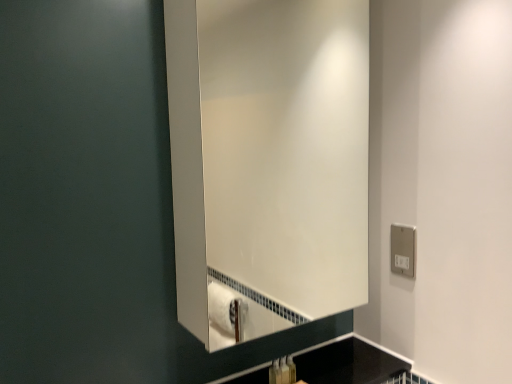
Measure the distance between black glossy countertop at lower center and camera.

3.68 feet.

Locate an element on the screen. This screenshot has height=384, width=512. silver metallic electric outlet at right is located at coordinates pos(403,250).

This screenshot has width=512, height=384. In order to click on white glossy mirror at center in this screenshot , I will do `click(267, 162)`.

Is matte plastic toothbrush at lower center, positioned as the first toiletry in right-to-left order, bigger than silver metallic electric outlet at right?

No.

Is there a large distance between matte plastic toothbrush at lower center, which appears as the second toiletry when viewed from the left, and silver metallic electric outlet at right?

matte plastic toothbrush at lower center, which appears as the second toiletry when viewed from the left, is near silver metallic electric outlet at right, not far away.

Is silver metallic electric outlet at right inside matte plastic toothbrush at lower center, which appears as the second toiletry when viewed from the left?

That's incorrect, silver metallic electric outlet at right is not inside matte plastic toothbrush at lower center, which appears as the second toiletry when viewed from the left.

Which is less distant, [286,363] or [278,209]?

Clearly, point [286,363] is closer to the camera than point [278,209].

Who is smaller, matte plastic toothbrush at lower center, positioned as the first toiletry in right-to-left order, or white glossy mirror at center?

matte plastic toothbrush at lower center, positioned as the first toiletry in right-to-left order, is smaller.

Is matte plastic toothbrush at lower center, which appears as the second toiletry when viewed from the left, situated inside white glossy mirror at center or outside?

matte plastic toothbrush at lower center, which appears as the second toiletry when viewed from the left, cannot be found inside white glossy mirror at center.

Is matte plastic toothbrush at lower center, which appears as the second toiletry when viewed from the left, at the back of white glossy mirror at center?

white glossy mirror at center does not have its back to matte plastic toothbrush at lower center, which appears as the second toiletry when viewed from the left.

Considering the sizes of white glossy mirror at center and matte plastic toothbrush at lower center, which appears as the second toiletry when viewed from the left, in the image, is white glossy mirror at center taller or shorter than matte plastic toothbrush at lower center, which appears as the second toiletry when viewed from the left,?

Considering their sizes, white glossy mirror at center has more height than matte plastic toothbrush at lower center, which appears as the second toiletry when viewed from the left.

Is white glossy mirror at center at the right side of matte plastic toothbrush at lower center, which appears as the second toiletry when viewed from the left?

In fact, white glossy mirror at center is to the left of matte plastic toothbrush at lower center, which appears as the second toiletry when viewed from the left.

Which is closer to the camera, (323, 138) or (289, 383)?

The point (289, 383) is closer.

Can you confirm if silver metallic electric outlet at right is shorter than white glossy mirror at center?

Yes.

Consider the image. How different are the orientations of silver metallic electric outlet at right and white glossy mirror at center in degrees?

The angular difference between silver metallic electric outlet at right and white glossy mirror at center is 92.5 degrees.

This screenshot has height=384, width=512. I want to click on electric outlet lying on the right of white glossy mirror at center, so click(403, 250).

Does silver metallic electric outlet at right have a smaller size compared to white glossy mirror at center?

Yes, silver metallic electric outlet at right is smaller than white glossy mirror at center.

In the scene shown: From the image's perspective, is silver metallic electric outlet at right located above or below matte plastic toothbrush at lower center, positioned as the first toiletry in right-to-left order?

silver metallic electric outlet at right is above matte plastic toothbrush at lower center, positioned as the first toiletry in right-to-left order.

Locate an element on the screen. toiletry that is the 1st one when counting leftward from the silver metallic electric outlet at right is located at coordinates (284, 371).

In terms of size, does silver metallic electric outlet at right appear bigger or smaller than matte plastic toothbrush at lower center, positioned as the first toiletry in right-to-left order?

Considering their sizes, silver metallic electric outlet at right takes up more space than matte plastic toothbrush at lower center, positioned as the first toiletry in right-to-left order.

Considering the relative positions of silver metallic electric outlet at right and matte plastic toothbrush at lower center, which appears as the second toiletry when viewed from the left, in the image provided, is silver metallic electric outlet at right to the left of matte plastic toothbrush at lower center, which appears as the second toiletry when viewed from the left, from the viewer's perspective?

Incorrect, silver metallic electric outlet at right is not on the left side of matte plastic toothbrush at lower center, which appears as the second toiletry when viewed from the left.

Considering the sizes of objects black glossy countertop at lower center and matte plastic toothbrush at lower center, positioned as the first toiletry in right-to-left order, in the image provided, who is bigger, black glossy countertop at lower center or matte plastic toothbrush at lower center, positioned as the first toiletry in right-to-left order,?

black glossy countertop at lower center is bigger.

Is black glossy countertop at lower center further to camera compared to matte plastic toothbrush at lower center, positioned as the first toiletry in right-to-left order?

That is False.

From a real-world perspective, is black glossy countertop at lower center positioned under matte plastic toothbrush at lower center, which appears as the second toiletry when viewed from the left, based on gravity?

Indeed, from a real-world perspective, black glossy countertop at lower center is positioned beneath matte plastic toothbrush at lower center, which appears as the second toiletry when viewed from the left.

Is black glossy countertop at lower center completely or partially outside of matte plastic toothbrush at lower center, which appears as the second toiletry when viewed from the left?

black glossy countertop at lower center lies outside matte plastic toothbrush at lower center, which appears as the second toiletry when viewed from the left,'s area.

From the image's perspective, does white glossy mirror at center appear lower than translucent plastic soap dispenser at lower center, which is counted as the 1th toiletry, starting from the left?

No, from the image's perspective, white glossy mirror at center is not below translucent plastic soap dispenser at lower center, which is counted as the 1th toiletry, starting from the left.

Is white glossy mirror at center smaller than translucent plastic soap dispenser at lower center, which is counted as the 1th toiletry, starting from the left?

Actually, white glossy mirror at center might be larger than translucent plastic soap dispenser at lower center, which is counted as the 1th toiletry, starting from the left.

Considering the sizes of objects white glossy mirror at center and translucent plastic soap dispenser at lower center, which is counted as the 1th toiletry, starting from the left, in the image provided, who is thinner, white glossy mirror at center or translucent plastic soap dispenser at lower center, which is counted as the 1th toiletry, starting from the left,?

translucent plastic soap dispenser at lower center, which is counted as the 1th toiletry, starting from the left, is thinner.

Between white glossy mirror at center and translucent plastic soap dispenser at lower center, which is counted as the 1th toiletry, starting from the left, which one is positioned in front?

Positioned in front is white glossy mirror at center.

From the image's perspective, starting from the silver metallic electric outlet at right, which toiletry is the 1st one below? Please provide its 2D coordinates.

[(284, 371)]

Where is `mirror on the left of matte plastic toothbrush at lower center, positioned as the first toiletry in right-to-left order`? This screenshot has width=512, height=384. mirror on the left of matte plastic toothbrush at lower center, positioned as the first toiletry in right-to-left order is located at coordinates (267, 162).

Looking at the image, which one is located closer to white glossy mirror at center, silver metallic electric outlet at right or translucent plastic soap dispenser at lower center, which is counted as the 1th toiletry, starting from the left?

Based on the image, silver metallic electric outlet at right appears to be nearer to white glossy mirror at center.

Based on their spatial positions, is black glossy countertop at lower center or white glossy mirror at center further from matte plastic toothbrush at lower center, which appears as the second toiletry when viewed from the left?

white glossy mirror at center is positioned further to the anchor matte plastic toothbrush at lower center, which appears as the second toiletry when viewed from the left.

When comparing their distances from silver metallic electric outlet at right, does black glossy countertop at lower center or white glossy mirror at center seem closer?

Among the two, black glossy countertop at lower center is located nearer to silver metallic electric outlet at right.

Based on their spatial positions, is white glossy mirror at center or matte plastic toothbrush at lower center, which appears as the second toiletry when viewed from the left, closer to silver metallic electric outlet at right?

The object closer to silver metallic electric outlet at right is matte plastic toothbrush at lower center, which appears as the second toiletry when viewed from the left.

When comparing their distances from silver metallic electric outlet at right, does matte plastic toothbrush at lower center, positioned as the first toiletry in right-to-left order, or black glossy countertop at lower center seem further?

The object further to silver metallic electric outlet at right is matte plastic toothbrush at lower center, positioned as the first toiletry in right-to-left order.

Consider the image. Based on their spatial positions, is white glossy mirror at center or matte plastic toothbrush at lower center, which appears as the second toiletry when viewed from the left, closer to black glossy countertop at lower center?

matte plastic toothbrush at lower center, which appears as the second toiletry when viewed from the left.

Which object lies nearer to the anchor point white glossy mirror at center, translucent plastic soap dispenser at lower center, which is counted as the 1th toiletry, starting from the left, or silver metallic electric outlet at right?

silver metallic electric outlet at right lies closer to white glossy mirror at center than the other object.

Estimate the real-world distances between objects in this image. Which object is further from translucent plastic soap dispenser at lower center, which is counted as the 1th toiletry, starting from the left, silver metallic electric outlet at right or matte plastic toothbrush at lower center, positioned as the first toiletry in right-to-left order?

silver metallic electric outlet at right lies further to translucent plastic soap dispenser at lower center, which is counted as the 1th toiletry, starting from the left, than the other object.

This screenshot has height=384, width=512. I want to click on electric outlet between white glossy mirror at center and matte plastic toothbrush at lower center, which appears as the second toiletry when viewed from the left, in the up-down direction, so click(403, 250).

Locate an element on the screen. toiletry positioned between black glossy countertop at lower center and matte plastic toothbrush at lower center, positioned as the first toiletry in right-to-left order, from near to far is located at coordinates (275, 372).

Where is `electric outlet between white glossy mirror at center and translucent plastic soap dispenser at lower center, which is counted as the 1th toiletry, starting from the left, in the vertical direction`? This screenshot has height=384, width=512. electric outlet between white glossy mirror at center and translucent plastic soap dispenser at lower center, which is counted as the 1th toiletry, starting from the left, in the vertical direction is located at coordinates (403, 250).

Find the location of a particular element. toiletry between white glossy mirror at center and translucent plastic soap dispenser at lower center, which is counted as the 1th toiletry, starting from the left, in the vertical direction is located at coordinates (284, 371).